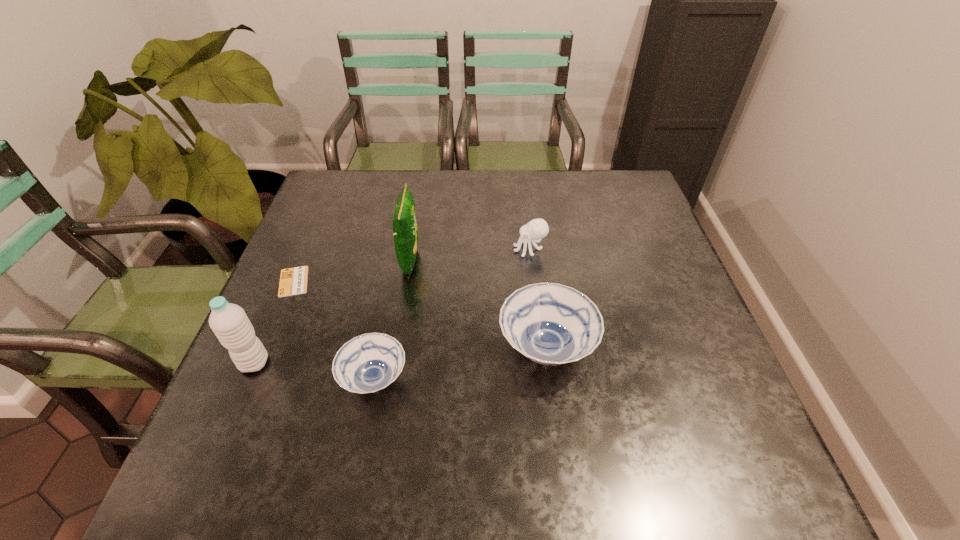
You are a GUI agent. You are given a task and a screenshot of the screen. Output one action in this format:
    pyautogui.click(x=<x>, y=<y>)
    Task: Click on the fifth tallest object
    Image resolution: width=960 pixels, height=540 pixels.
    Given the screenshot: What is the action you would take?
    pyautogui.click(x=368, y=363)

Where is `the shorter soup bowl`? the shorter soup bowl is located at coordinates (368, 363).

You are a GUI agent. You are given a task and a screenshot of the screen. Output one action in this format:
    pyautogui.click(x=<x>, y=<y>)
    Task: Click on the right soup bowl
    This screenshot has width=960, height=540.
    Given the screenshot: What is the action you would take?
    pyautogui.click(x=552, y=324)

Locate an element on the screen. This screenshot has height=540, width=960. crisp (potato chip) is located at coordinates (405, 232).

Find the location of `identity card`. identity card is located at coordinates (293, 281).

You are a GUI agent. You are given a task and a screenshot of the screen. Output one action in this format:
    pyautogui.click(x=<x>, y=<y>)
    Task: Click on the water bottle
    The width and height of the screenshot is (960, 540).
    Given the screenshot: What is the action you would take?
    pyautogui.click(x=229, y=322)

Where is `octopus`? The height and width of the screenshot is (540, 960). octopus is located at coordinates (537, 228).

Where is `free region located on the left of the left soup bowl`? The height and width of the screenshot is (540, 960). free region located on the left of the left soup bowl is located at coordinates (280, 379).

Where is `free space located on the back of the right soup bowl`? free space located on the back of the right soup bowl is located at coordinates (529, 214).

Locate an element on the screen. The width and height of the screenshot is (960, 540). vacant area located on the front-facing side of the crisp (potato chip) is located at coordinates (440, 260).